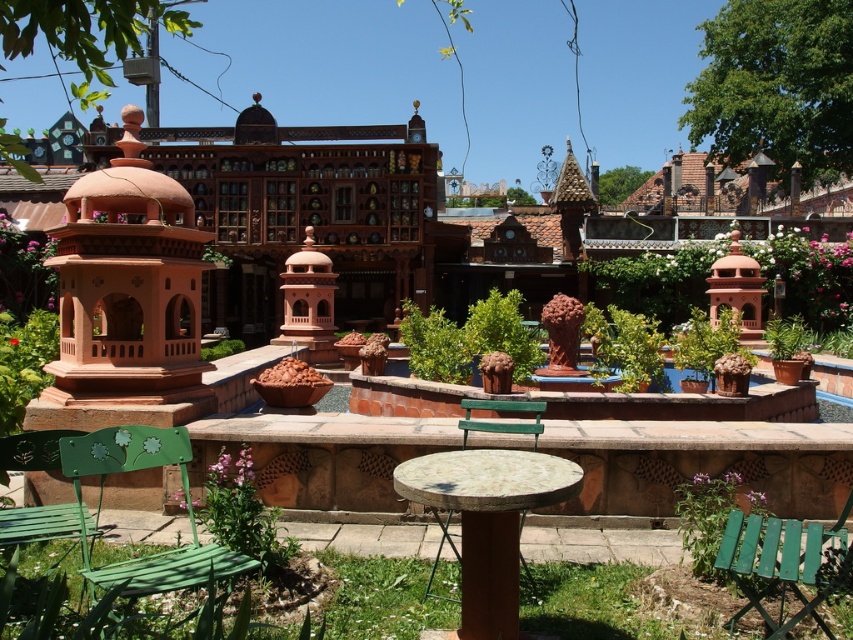
Consider the image. You are a visitor standing at the entrance of the garden. You see the terracotta clay gazebo at left and the green wood chair at lower right. The garden has a strict rule that you must stay at least 20 feet away from any structure. Are you currently violating this rule?

The terracotta clay gazebo at left is 22.79 feet away from the green wood chair at lower right. Since the minimum required distance is 20 feet, you are not violating the rule as the distance between them exceeds the 20 feet requirement.

You are planning to place a large rectangular plant pot that is 2 meters wide on the marble stone table at center or the green wood bench at center. Based on their widths, which object can accommodate the plant pot?

The marble stone table at center might be wider than green wood bench at center, so it is possible that the marble stone table at center can accommodate the plant pot if its width is sufficient. However, without exact measurements, this is uncertain.

You are planning to sit on one of the benches in the garden. Both the green metal bench at lower left and the green painted wood bench at lower left are available. Which bench would you choose if you want to sit with more people?

The green metal bench at lower left is bigger than the green painted wood bench at lower left, so you should choose the green metal bench at lower left to sit with more people.